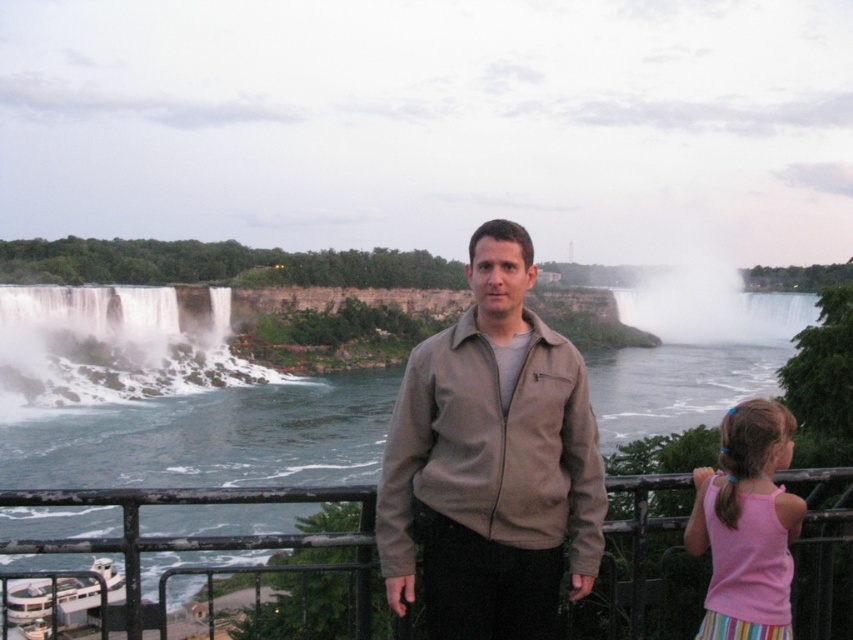
Question: Is matte brown jacket at center smaller than pink fabric hairband at lower right?

Choices:
 (A) yes
 (B) no

Answer: (A)

Question: Can you confirm if matte brown jacket at center is bigger than pink fabric hairband at lower right?

Choices:
 (A) yes
 (B) no

Answer: (B)

Question: Is matte brown jacket at center to the right of black metal railing at center from the viewer's perspective?

Choices:
 (A) yes
 (B) no

Answer: (A)

Question: Which object is positioned farthest from the matte brown jacket at center?

Choices:
 (A) pink fabric hairband at lower right
 (B) black metal railing at center

Answer: (B)

Question: Among these objects, which one is farthest from the camera?

Choices:
 (A) black metal railing at center
 (B) matte brown jacket at center

Answer: (B)

Question: Which of the following is the closest to the observer?

Choices:
 (A) pink fabric hairband at lower right
 (B) black metal railing at center
 (C) matte brown jacket at center

Answer: (B)